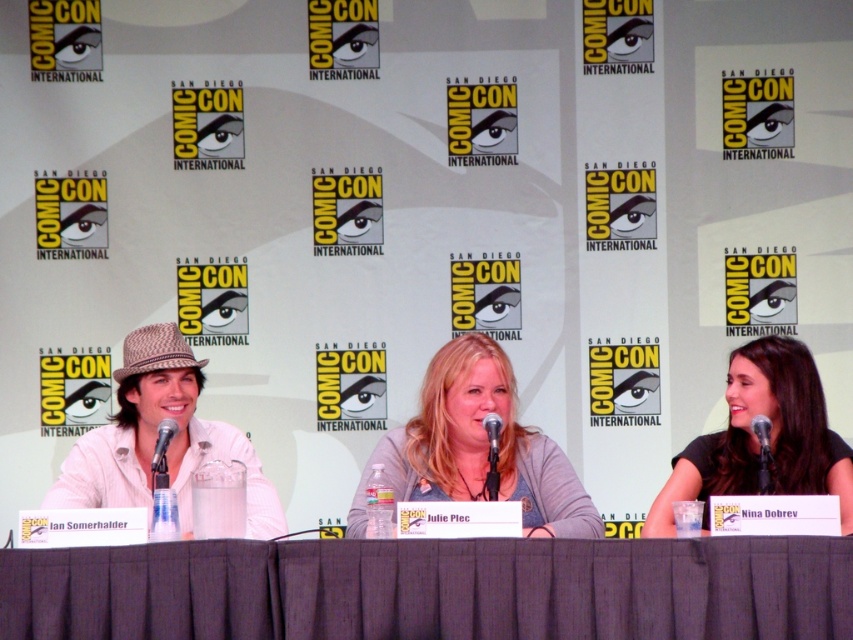
You are attending Comic Con and want to take a photo of the gray fabric table at center and the gray cotton shirt at center. Which object should you focus on first if you want to capture both in a single frame without moving the camera? Explain your reasoning based on their positions.

The gray fabric table at center is positioned on the left side of the gray cotton shirt at center. To capture both in a single frame without moving the camera, you should focus on the gray fabric table at center first since it is closer to the left edge of the frame, allowing the shirt to be included on the right side.

You are attending Comic Con and want to take a photo of the gray fabric table at center. Where should you stand to capture it in the best possible way?

The gray fabric table at center is located at point (433, 589), so you should position yourself directly in front of it to ensure it is centered and fully visible in your photo.

You are a photographer at the Comic Con panel discussion. You need to capture a closeup of the matte black microphone at center and the black metallic microphone at center. Which microphone is on the left side when viewed from the audience perspective?

The matte black microphone at center is positioned on the left side of the black metallic microphone at center, so when viewed from the audience perspective, the matte black microphone at center is on the left side.